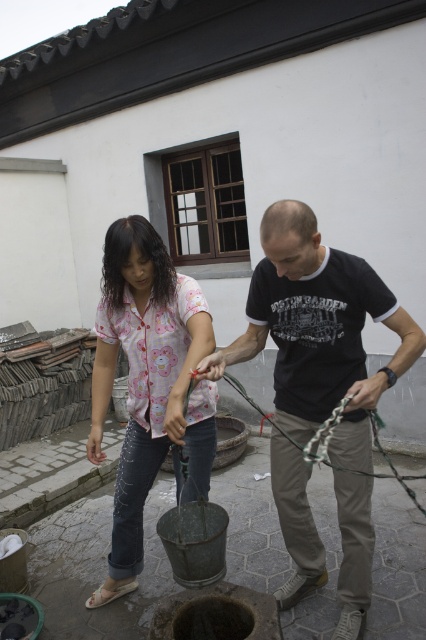
You are a photographer standing at the edge of the paved area. You need to capture a photo where both the floral cotton shirt at center and the green rubber rope at center are clearly visible. Considering their heights, which object might appear larger in the photo?

The floral cotton shirt at center is much taller than the green rubber rope at center, so it will appear larger in the photo.

You are standing in the scene and notice the black cotton shirt at center and the green rubber rope at center. Which object is positioned higher relative to the other?

The black cotton shirt at center is located above the green rubber rope at center, so it is positioned higher.